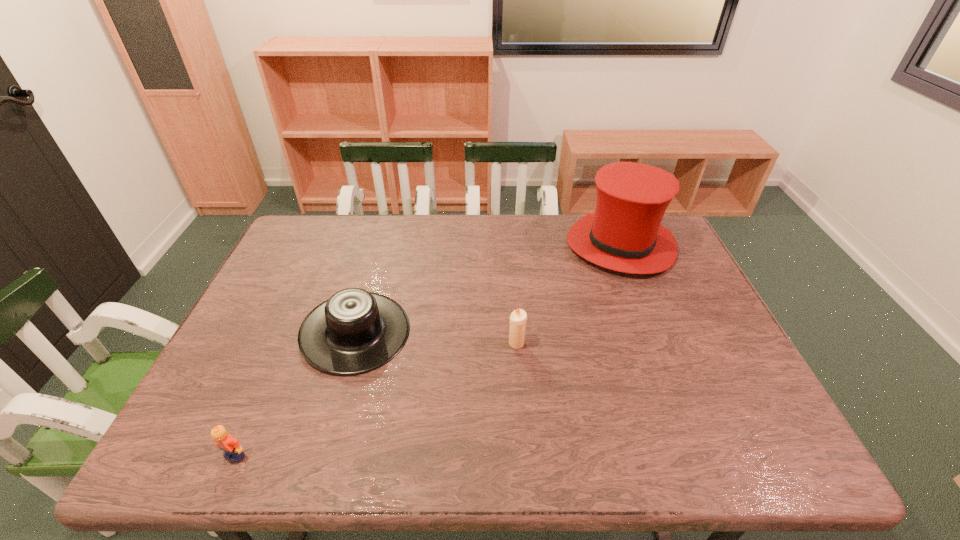
Find the location of a particular element. the rightmost object is located at coordinates (624, 233).

The height and width of the screenshot is (540, 960). Find the location of `the tallest object`. the tallest object is located at coordinates (624, 233).

Locate an element on the screen. This screenshot has height=540, width=960. candle is located at coordinates pos(518,318).

You are a GUI agent. You are given a task and a screenshot of the screen. Output one action in this format:
    pyautogui.click(x=<x>, y=<y>)
    Task: Click on the left dress hat
    The width and height of the screenshot is (960, 540).
    Given the screenshot: What is the action you would take?
    pyautogui.click(x=355, y=331)

You are a GUI agent. You are given a task and a screenshot of the screen. Output one action in this format:
    pyautogui.click(x=<x>, y=<y>)
    Task: Click on the nearer dress hat
    This screenshot has width=960, height=540.
    Given the screenshot: What is the action you would take?
    pyautogui.click(x=355, y=331)

Locate an element on the screen. The height and width of the screenshot is (540, 960). Lego is located at coordinates (233, 451).

This screenshot has width=960, height=540. In order to click on the nearest object in this screenshot , I will do `click(233, 451)`.

Identify the location of vacant position located 0.080m on the front of the rightmost object. This screenshot has width=960, height=540. (642, 299).

You are a GUI agent. You are given a task and a screenshot of the screen. Output one action in this format:
    pyautogui.click(x=<x>, y=<y>)
    Task: Click on the vacant space located 0.370m on the left of the third object from left to right
    
    Given the screenshot: What is the action you would take?
    pyautogui.click(x=363, y=343)

At what (x,y) coordinates should I click in order to perform the action: click on free spot located 0.110m on the left of the second object from left to right. Please return your answer as a coordinate pair (x, y). The height and width of the screenshot is (540, 960). Looking at the image, I should click on (260, 333).